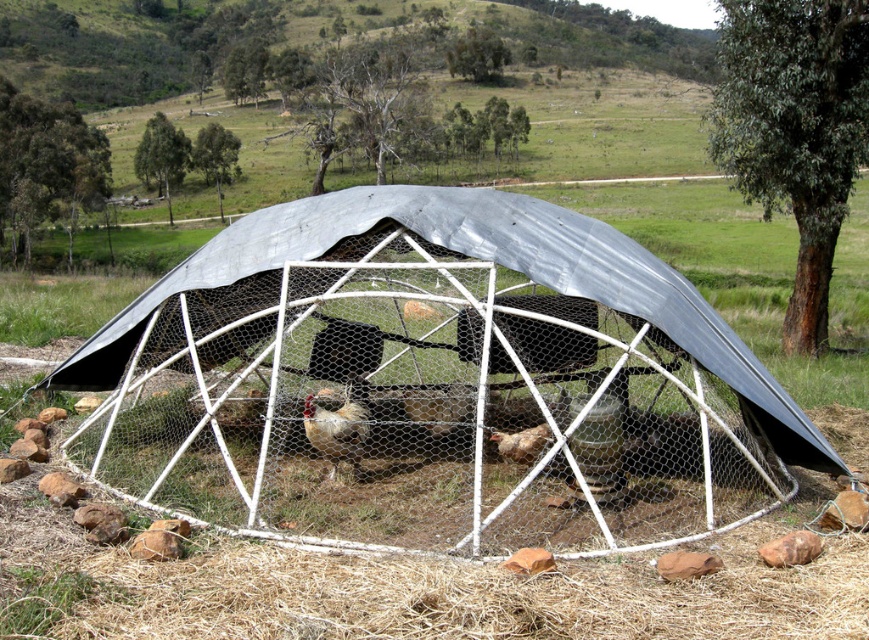
Question: In this image, where is metallic wire mesh cage at center located relative to brown speckled feathers at center?

Choices:
 (A) below
 (B) above

Answer: (B)

Question: Is golden brown feathers at center smaller than brown speckled feathers at center?

Choices:
 (A) yes
 (B) no

Answer: (B)

Question: Is metallic wire mesh cage at center below brown speckled feathers at center?

Choices:
 (A) yes
 (B) no

Answer: (B)

Question: Which object is positioned closest to the golden brown feathers at center?

Choices:
 (A) metallic wire mesh cage at center
 (B) brown speckled feathers at center

Answer: (B)

Question: Which of the following is the farthest from the observer?

Choices:
 (A) metallic wire mesh cage at center
 (B) golden brown feathers at center
 (C) brown speckled feathers at center

Answer: (C)

Question: Which point is closer to the camera?

Choices:
 (A) click(x=498, y=436)
 (B) click(x=348, y=426)

Answer: (B)